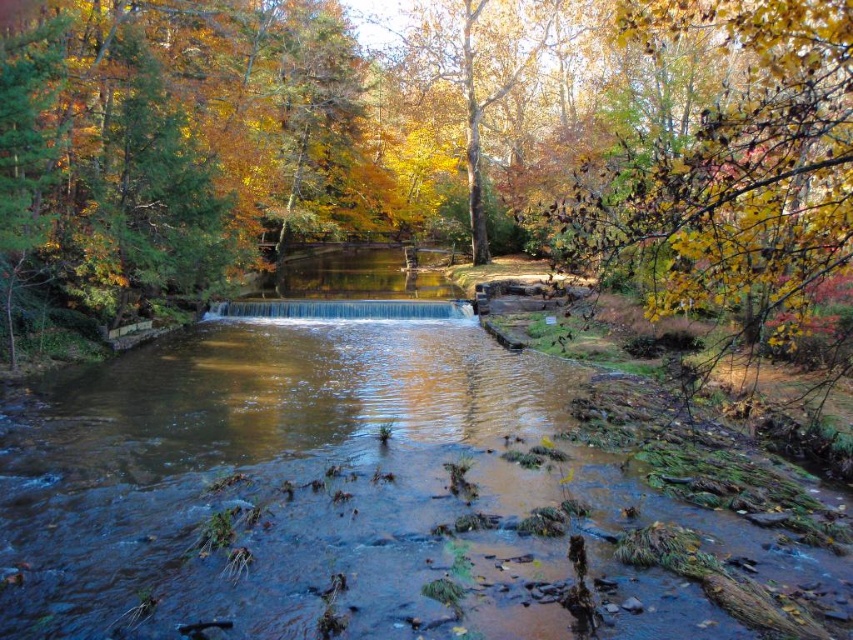
Question: Which object appears closest to the camera in this image?

Choices:
 (A) yellow leafy branch at upper right
 (B) brown smooth water at center

Answer: (A)

Question: Among these points, which one is nearest to the camera?

Choices:
 (A) (427, 332)
 (B) (828, 132)

Answer: (B)

Question: Is brown smooth water at center positioned before yellow leafy branch at upper right?

Choices:
 (A) yes
 (B) no

Answer: (B)

Question: Can you confirm if brown smooth water at center is smaller than yellow leafy branch at upper right?

Choices:
 (A) no
 (B) yes

Answer: (B)

Question: Can you confirm if brown smooth water at center is positioned to the right of yellow leafy branch at upper right?

Choices:
 (A) no
 (B) yes

Answer: (A)